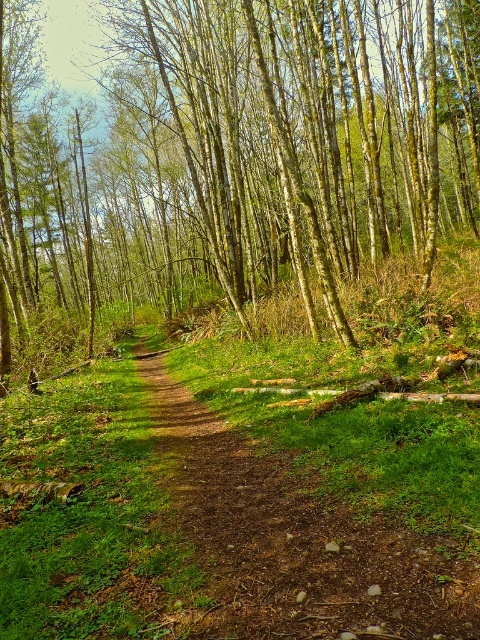
Can you confirm if brown smooth tree at center is wider than dirt path at center?

Indeed, brown smooth tree at center has a greater width compared to dirt path at center.

Between brown smooth tree at center and dirt path at center, which one is positioned higher?

brown smooth tree at center is higher up.

I want to click on brown smooth tree at center, so click(235, 161).